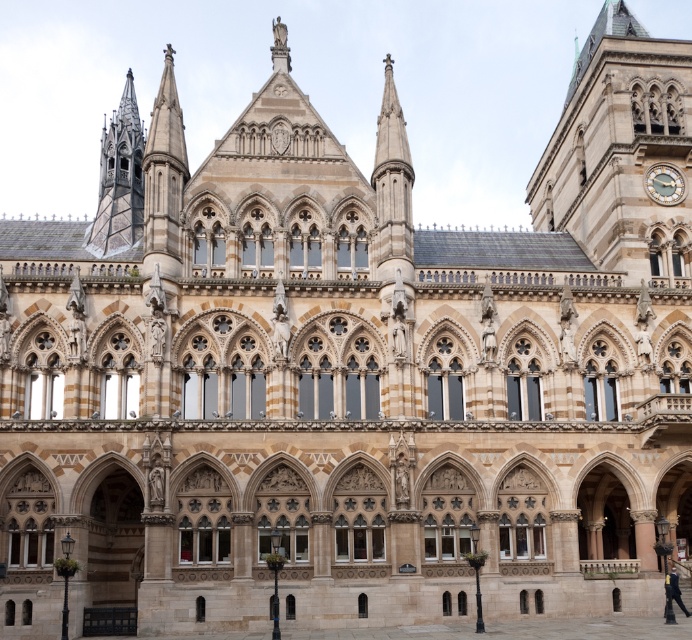
Question: Which of the following is the farthest from the observer?

Choices:
 (A) (662, 179)
 (B) (675, 588)

Answer: (A)

Question: Is golden stone clock tower at upper right smaller than gold metallic clock at upper right?

Choices:
 (A) no
 (B) yes

Answer: (A)

Question: Does golden stone clock tower at upper right have a greater width compared to gold metallic clock at upper right?

Choices:
 (A) yes
 (B) no

Answer: (A)

Question: Which point is closer to the camera taking this photo?

Choices:
 (A) (677, 184)
 (B) (531, 189)
 (C) (673, 576)

Answer: (C)

Question: Which point is farther to the camera?

Choices:
 (A) (666, 172)
 (B) (614, 195)

Answer: (A)

Question: Is golden stone clock tower at upper right wider than gold metallic clock at upper right?

Choices:
 (A) yes
 (B) no

Answer: (A)